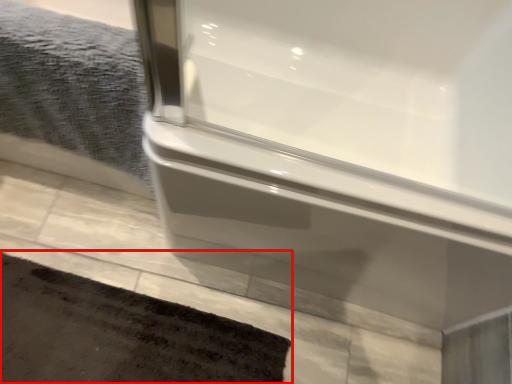
Question: From the image's perspective, what is the correct spatial positioning of bath mat (annotated by the red box) in reference to bath towel?

Choices:
 (A) below
 (B) above

Answer: (A)